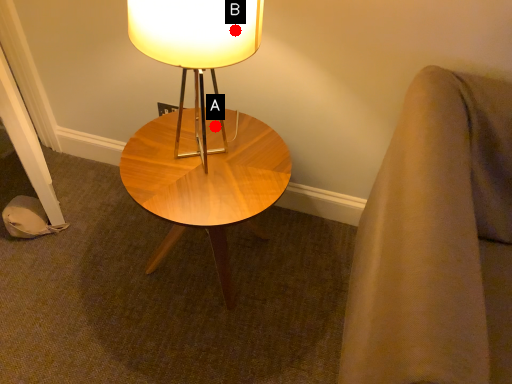
Question: Two points are circled on the image, labeled by A and B beside each circle. Which point is farther to the camera?

Choices:
 (A) A is further
 (B) B is further

Answer: (A)